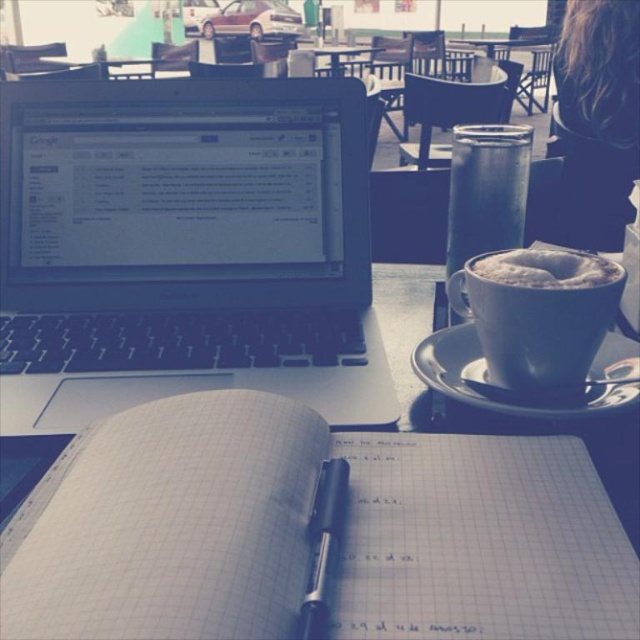
From the picture: You are a barista trying to place a new coffee cup on the table. The cup is 10 cm tall. Which object, the metallic glass at upper right or the wooden table at upper center, is shorter and can accommodate the cup without it sticking out?

The metallic glass at upper right is shorter than the wooden table at upper center, so the cup can be placed on the metallic glass at upper right since it is shorter and can accommodate the cup without it sticking out.

You are a barista trying to place a new order on the table. The table has limited space. You need to place a large tray between the metallic glass at upper right and the black ceramic saucer at lower right. Is there enough vertical space for the tray?

The metallic glass at upper right is above the black ceramic saucer at lower right, so there is sufficient vertical space between them to place the large tray.